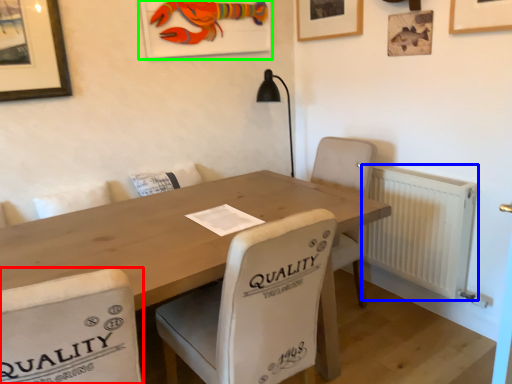
Question: Which is nearer to the chair (highlighted by a red box)? radiator (highlighted by a blue box) or picture frame (highlighted by a green box).

Choices:
 (A) radiator
 (B) picture frame

Answer: (A)